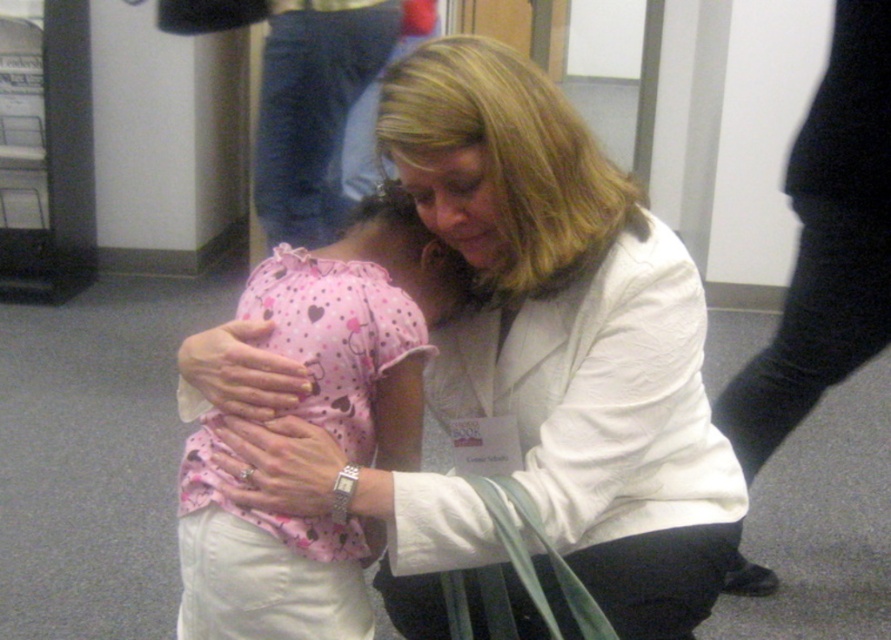
You are a tailor measuring the distance between two fabrics for a custom fitting. The white smooth coat at center is part of a medical professional outfit, and the pink dotted fabric at center belongs to a child. Can your measuring tape handle the gap between them?

The distance between the white smooth coat at center and the pink dotted fabric at center is 5.41 inches, so the tailor can measure this gap with a standard measuring tape since it is within typical measuring tape lengths.

You are a tailor measuring two fabrics in the image. The white smooth coat at center and the pink dotted fabric at center. Which fabric is taller?

The white smooth coat at center is much taller than the pink dotted fabric at center.

You are an interior designer working on a layout for a medical office. You need to place a desk and a chair in the room where the white smooth coat at center is currently located. Based on the coat position at point 0.522, 0.639, where should you position the desk and chair to ensure they are not obstructing the coat?

The white smooth coat at center is located at point (568,333). To avoid obstruction, place the desk and chair in an area that does not overlap with this coordinate, such as near the edges or corners of the room.